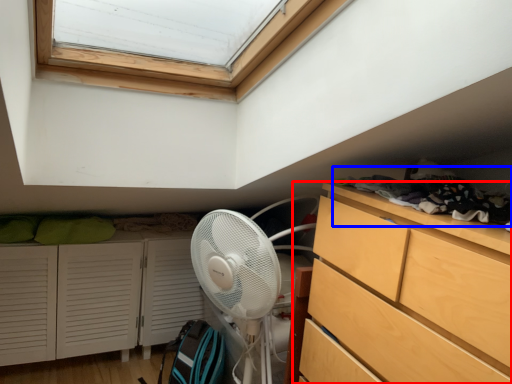
Question: Which object is closer to the camera taking this photo, chest of drawers (highlighted by a red box) or laundry (highlighted by a blue box)?

Choices:
 (A) chest of drawers
 (B) laundry

Answer: (A)